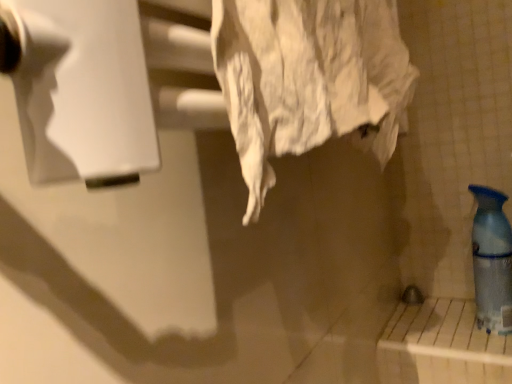
The width and height of the screenshot is (512, 384). Describe the element at coordinates (492, 261) in the screenshot. I see `blue glossy bottle at right` at that location.

Locate an element on the screen. blue glossy bottle at right is located at coordinates (492, 261).

What is the approximate height of blue glossy bottle at right?

It is 9.96 inches.

Measure the distance between point (480,239) and camera.

The distance of point (480,239) from camera is 26.93 inches.

What is the approximate width of blue glossy bottle at right?

blue glossy bottle at right is 2.50 inches in width.

The image size is (512, 384). Identify the location of blue glossy bottle at right. (492, 261).